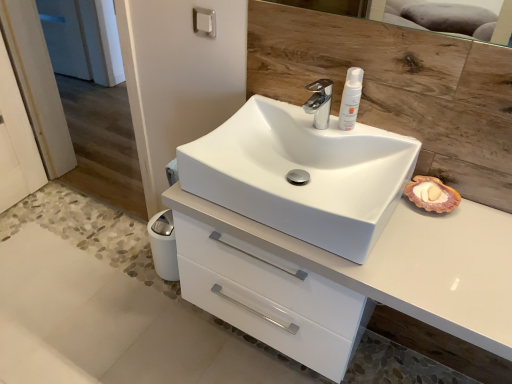
Find the location of a particular element. vacant space that is to the left of white matte lotion at upper center is located at coordinates point(305,116).